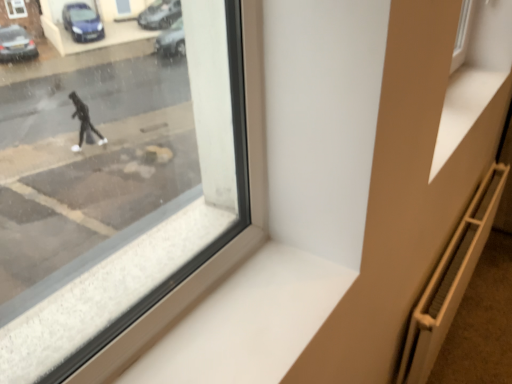
Where is `brown textured radiator at lower right`? The width and height of the screenshot is (512, 384). brown textured radiator at lower right is located at coordinates (482, 322).

Identify the location of metallic radiator at lower right. Image resolution: width=512 pixels, height=384 pixels. (450, 280).

From a real-world perspective, is brown textured radiator at lower right positioned over white smooth window sill at lower center based on gravity?

Incorrect, from a real-world perspective, brown textured radiator at lower right is lower than white smooth window sill at lower center.

Is brown textured radiator at lower right bigger than white smooth window sill at lower center?

Yes, brown textured radiator at lower right is bigger than white smooth window sill at lower center.

Considering the relative sizes of metallic radiator at lower right and brown textured radiator at lower right in the image provided, is metallic radiator at lower right thinner than brown textured radiator at lower right?

Yes.

Which of these two, metallic radiator at lower right or brown textured radiator at lower right, stands taller?

metallic radiator at lower right is taller.

Looking at this image, is metallic radiator at lower right located outside brown textured radiator at lower right?

metallic radiator at lower right is positioned outside brown textured radiator at lower right.

Is metallic radiator at lower right far away from brown textured radiator at lower right?

They are positioned close to each other.

Relative to white smooth window sill at lower center, is metallic radiator at lower right in front or behind?

metallic radiator at lower right is behind white smooth window sill at lower center.

From a real-world perspective, is metallic radiator at lower right over white smooth window sill at lower center?

No, from a real-world perspective, metallic radiator at lower right is not above white smooth window sill at lower center.

Is metallic radiator at lower right spatially inside white smooth window sill at lower center, or outside of it?

metallic radiator at lower right is located beyond the bounds of white smooth window sill at lower center.

Considering the relative sizes of metallic radiator at lower right and white smooth window sill at lower center in the image provided, is metallic radiator at lower right taller than white smooth window sill at lower center?

Indeed, metallic radiator at lower right has a greater height compared to white smooth window sill at lower center.

Is white smooth window sill at lower center completely or partially outside of metallic radiator at lower right?

white smooth window sill at lower center lies outside metallic radiator at lower right's area.

In terms of height, does white smooth window sill at lower center look taller or shorter compared to metallic radiator at lower right?

white smooth window sill at lower center is shorter than metallic radiator at lower right.

At what (x,y) coordinates should I click in order to perform the action: click on window sill that is in front of the metallic radiator at lower right. Please return your answer as a coordinate pair (x, y). Looking at the image, I should click on (249, 322).

Is metallic radiator at lower right at the back of white smooth window sill at lower center?

No, white smooth window sill at lower center is not facing away from metallic radiator at lower right.

Is brown textured radiator at lower right turned away from metallic radiator at lower right?

No.

Between brown textured radiator at lower right and metallic radiator at lower right, which one is positioned behind?

brown textured radiator at lower right is more distant.

Is brown textured radiator at lower right taller or shorter than metallic radiator at lower right?

Clearly, brown textured radiator at lower right is shorter compared to metallic radiator at lower right.

Considering the relative sizes of white smooth window sill at lower center and brown textured radiator at lower right in the image provided, is white smooth window sill at lower center thinner than brown textured radiator at lower right?

Yes, white smooth window sill at lower center is thinner than brown textured radiator at lower right.

Could you tell me if white smooth window sill at lower center is facing brown textured radiator at lower right?

No, white smooth window sill at lower center is not facing towards brown textured radiator at lower right.

Consider the image. Between white smooth window sill at lower center and brown textured radiator at lower right, which one has more height?

With more height is brown textured radiator at lower right.

From a real-world perspective, relative to brown textured radiator at lower right, is white smooth window sill at lower center vertically above or below?

From a real-world perspective, white smooth window sill at lower center is physically above brown textured radiator at lower right.

You are a GUI agent. You are given a task and a screenshot of the screen. Output one action in this format:
    pyautogui.click(x=<x>, y=<y>)
    Task: Click on the window sill positioned vertically above the brown textured radiator at lower right (from a real-world perspective)
    This screenshot has width=512, height=384.
    Given the screenshot: What is the action you would take?
    pyautogui.click(x=249, y=322)

The image size is (512, 384). Identify the location of stairwell in front of the brown textured radiator at lower right. (450, 280).

Looking at the image, which one is located closer to white smooth window sill at lower center, metallic radiator at lower right or brown textured radiator at lower right?

Based on the image, metallic radiator at lower right appears to be nearer to white smooth window sill at lower center.

When comparing their distances from white smooth window sill at lower center, does brown textured radiator at lower right or metallic radiator at lower right seem closer?

metallic radiator at lower right is positioned closer to the anchor white smooth window sill at lower center.

Which object lies nearer to the anchor point metallic radiator at lower right, white smooth window sill at lower center or brown textured radiator at lower right?

brown textured radiator at lower right is closer to metallic radiator at lower right.

Looking at the image, which one is located closer to brown textured radiator at lower right, white smooth window sill at lower center or metallic radiator at lower right?

metallic radiator at lower right is positioned closer to the anchor brown textured radiator at lower right.

Looking at the image, which one is located closer to metallic radiator at lower right, brown textured radiator at lower right or white smooth window sill at lower center?

The object closer to metallic radiator at lower right is brown textured radiator at lower right.

Considering their positions, is metallic radiator at lower right positioned further to brown textured radiator at lower right than white smooth window sill at lower center?

white smooth window sill at lower center is positioned further to the anchor brown textured radiator at lower right.

At what (x,y) coordinates should I click in order to perform the action: click on stairwell between white smooth window sill at lower center and brown textured radiator at lower right in the horizontal direction. Please return your answer as a coordinate pair (x, y). Looking at the image, I should click on (450, 280).